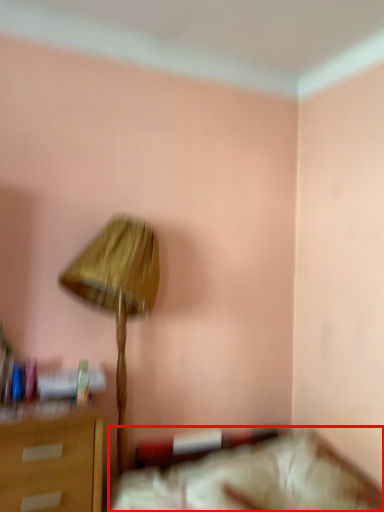
Question: Where is furniture (annotated by the red box) located in relation to lamp in the image?

Choices:
 (A) left
 (B) right

Answer: (B)